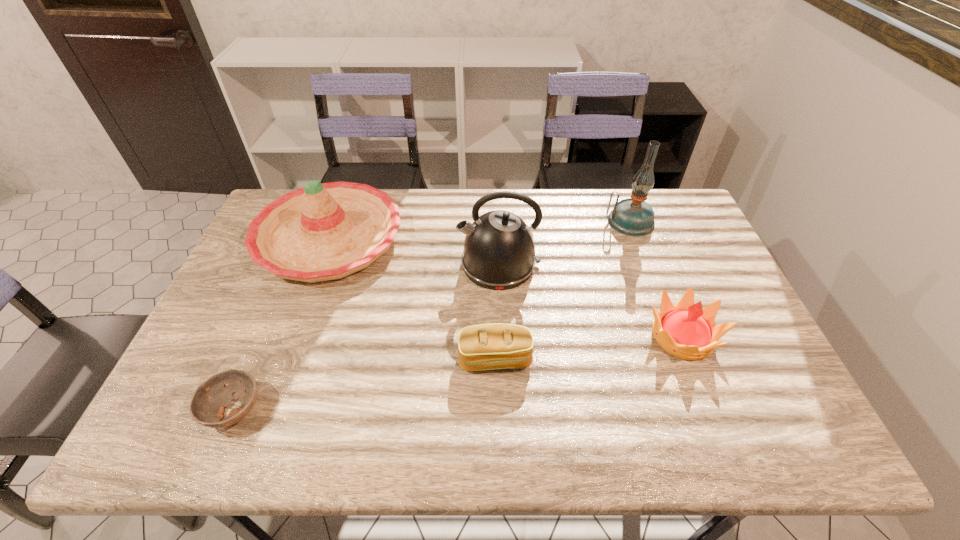
Identify the location of vacant area that lies between the bowl and the third shortest object. (459, 373).

At what (x,y) coordinates should I click in order to perform the action: click on vacant point located between the kettle and the crown. Please return your answer as a coordinate pair (x, y). The width and height of the screenshot is (960, 540). Looking at the image, I should click on (590, 300).

Identify the location of free space between the crown and the nearest object. (459, 373).

The image size is (960, 540). What are the coordinates of `vacant area that lies between the bowl and the sombrero` in the screenshot? It's located at (282, 324).

This screenshot has height=540, width=960. Identify the location of free space between the kettle and the third tallest object. (414, 251).

Locate an element on the screen. empty space between the kettle and the oil lamp is located at coordinates (564, 243).

Where is `free area in between the kettle and the oil lamp`? The image size is (960, 540). free area in between the kettle and the oil lamp is located at coordinates (564, 243).

Where is `empty space between the clutch bag and the kettle`? The height and width of the screenshot is (540, 960). empty space between the clutch bag and the kettle is located at coordinates (497, 312).

Identify the location of vacant space that's between the sombrero and the shortest object. (282, 324).

Locate an element on the screen. This screenshot has width=960, height=540. empty location between the nearest object and the clutch bag is located at coordinates (365, 384).